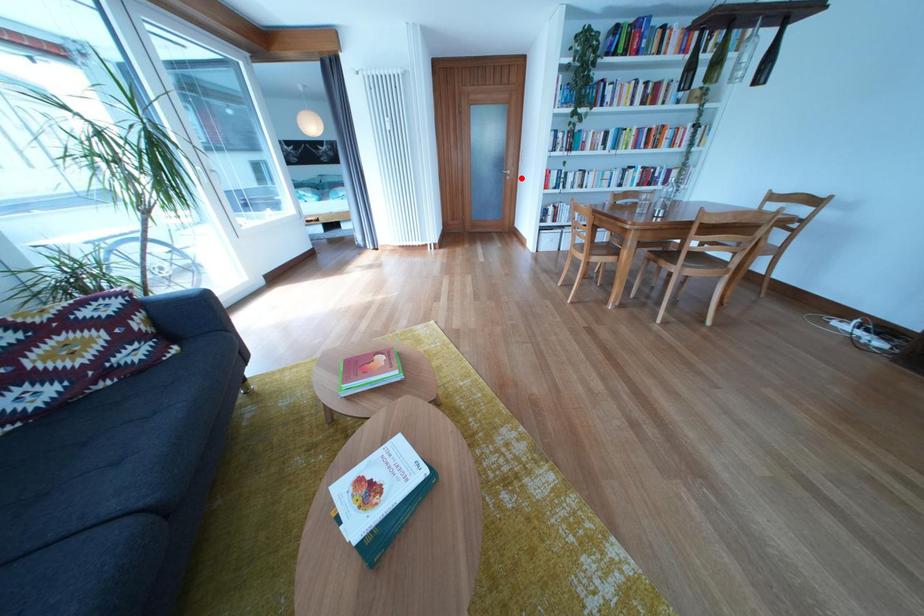
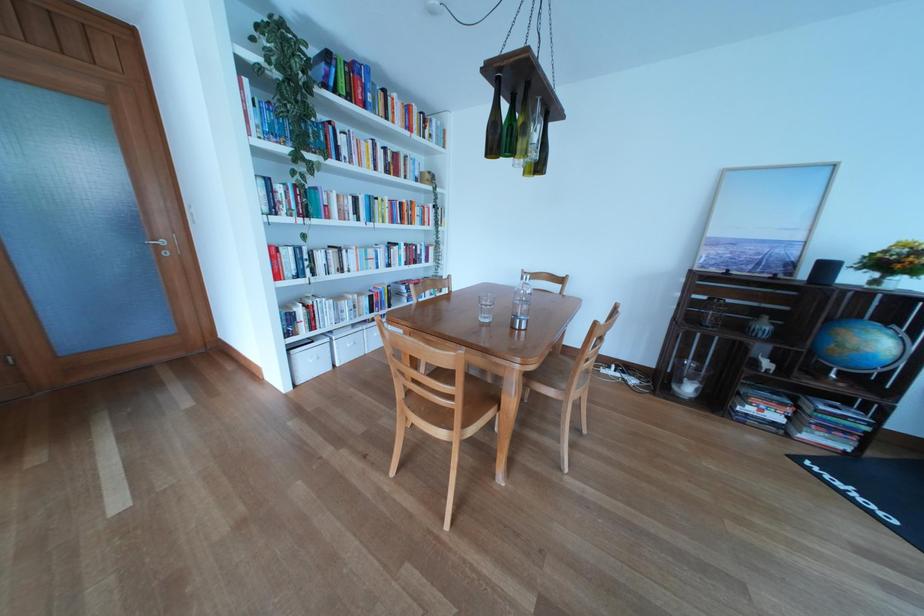
Question: I am providing you with two images of the same scene from different viewpoints. Image1 has a red point marked. In image2, the corresponding 3D location appears at what relative position? Reply with the corresponding letter.

Choices:
 (A) Closer
 (B) Farther

Answer: (B)